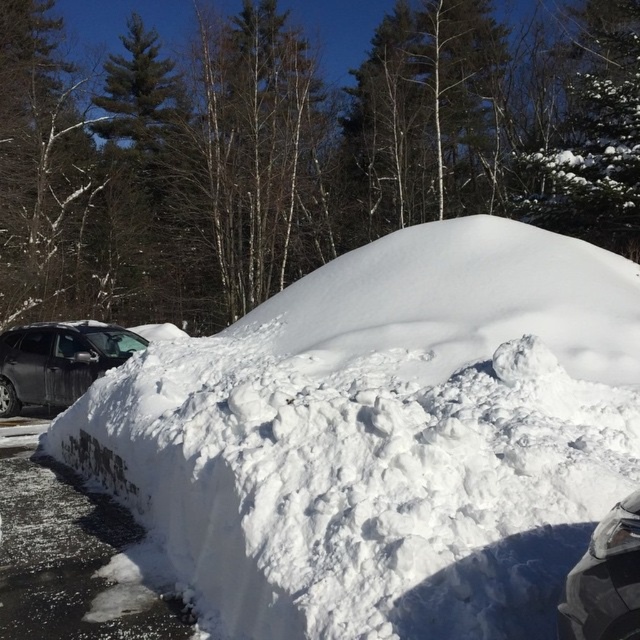
You are standing in the snowy landscape and want to place a small snowman exactly where the white fluffy snow at center is located. Is this location suitable for building the snowman?

Yes, the white fluffy snow at center is located at point (x=381, y=438), which is suitable for building a snowman as it provides a stable base.